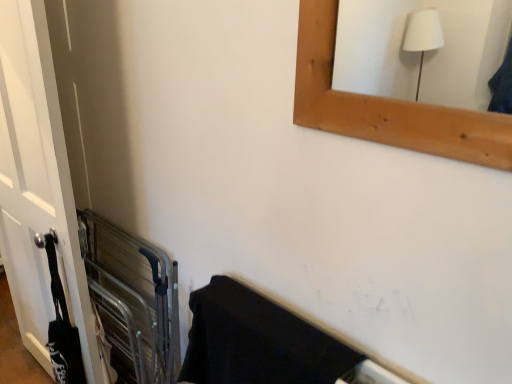
At what (x,y) coordinates should I click in order to perform the action: click on metallic gray balustrade at left. Please return your answer as a coordinate pair (x, y). Looking at the image, I should click on (133, 300).

What do you see at coordinates (257, 341) in the screenshot?
I see `black matte towel at lower right` at bounding box center [257, 341].

This screenshot has width=512, height=384. In order to click on white matte door at left in this screenshot , I will do `click(37, 185)`.

This screenshot has width=512, height=384. I want to click on bath towel lying on the right of white matte door at left, so click(x=257, y=341).

Can you confirm if black matte towel at lower right is shorter than white matte door at left?

Yes.

From a real-world perspective, which object rests below the other?

black matte towel at lower right.

Between black matte towel at lower right and metallic gray balustrade at left, which one has less height?

Standing shorter between the two is black matte towel at lower right.

Which object is closer to the camera, black matte towel at lower right or metallic gray balustrade at left?

Positioned in front is black matte towel at lower right.

Can we say black matte towel at lower right lies outside metallic gray balustrade at left?

Indeed, black matte towel at lower right is completely outside metallic gray balustrade at left.

Considering the relative sizes of black matte towel at lower right and metallic gray balustrade at left in the image provided, is black matte towel at lower right bigger than metallic gray balustrade at left?

Result: No, black matte towel at lower right is not bigger than metallic gray balustrade at left.

Is white matte door at left turned away from metallic gray balustrade at left?

That's right, white matte door at left is facing away from metallic gray balustrade at left.

Based on the photo, from a real-world perspective, is white matte door at left physically below metallic gray balustrade at left?

No, from a real-world perspective, white matte door at left is not beneath metallic gray balustrade at left.

Can you confirm if white matte door at left is positioned to the left of metallic gray balustrade at left?

Indeed, white matte door at left is positioned on the left side of metallic gray balustrade at left.

Considering the points (14, 149) and (152, 262), which point is in front, point (14, 149) or point (152, 262)?

The point (14, 149) is in front.

In the scene shown: Considering the sizes of objects white matte door at left and black matte towel at lower right in the image provided, who is smaller, white matte door at left or black matte towel at lower right?

With smaller size is black matte towel at lower right.

Is white matte door at left touching black matte towel at lower right?

No, white matte door at left is not with black matte towel at lower right.

From the image's perspective, does white matte door at left appear lower than black matte towel at lower right?

No, from the image's perspective, white matte door at left is not beneath black matte towel at lower right.

Is metallic gray balustrade at left not inside black matte towel at lower right?

Indeed, metallic gray balustrade at left is completely outside black matte towel at lower right.

Are metallic gray balustrade at left and black matte towel at lower right beside each other?

There is a gap between metallic gray balustrade at left and black matte towel at lower right.

Which object is further away from the camera taking this photo, metallic gray balustrade at left or black matte towel at lower right?

metallic gray balustrade at left is further from the camera.

Could white matte door at left be considered to be inside metallic gray balustrade at left?

No, white matte door at left is not inside metallic gray balustrade at left.

Considering the positions of point (115, 226) and point (8, 229), is point (115, 226) closer or farther from the camera than point (8, 229)?

Point (115, 226).

Consider the image. Can you confirm if metallic gray balustrade at left is taller than white matte door at left?

In fact, metallic gray balustrade at left may be shorter than white matte door at left.

Is metallic gray balustrade at left looking in the opposite direction of white matte door at left?

No, metallic gray balustrade at left is not facing the opposite direction of white matte door at left.

At what (x,y) coordinates should I click in order to perform the action: click on bath towel below the white matte door at left (from the image's perspective). Please return your answer as a coordinate pair (x, y). Looking at the image, I should click on (257, 341).

Image resolution: width=512 pixels, height=384 pixels. What are the coordinates of `bath towel that is in front of the metallic gray balustrade at left` in the screenshot? It's located at (257, 341).

Considering their positions, is metallic gray balustrade at left positioned further to black matte towel at lower right than white matte door at left?

The object further to black matte towel at lower right is white matte door at left.

When comparing their distances from black matte towel at lower right, does white matte door at left or metallic gray balustrade at left seem closer?

The object closer to black matte towel at lower right is metallic gray balustrade at left.

Estimate the real-world distances between objects in this image. Which object is further from metallic gray balustrade at left, white matte door at left or black matte towel at lower right?

Among the two, black matte towel at lower right is located further to metallic gray balustrade at left.

From the picture: When comparing their distances from metallic gray balustrade at left, does black matte towel at lower right or white matte door at left seem further?

Based on the image, black matte towel at lower right appears to be further to metallic gray balustrade at left.

Looking at the image, which one is located further to white matte door at left, metallic gray balustrade at left or black matte towel at lower right?

The object further to white matte door at left is black matte towel at lower right.

Based on their spatial positions, is black matte towel at lower right or metallic gray balustrade at left further from white matte door at left?

The object further to white matte door at left is black matte towel at lower right.

This screenshot has height=384, width=512. In order to click on balustrade between white matte door at left and black matte towel at lower right in the horizontal direction in this screenshot , I will do `click(133, 300)`.